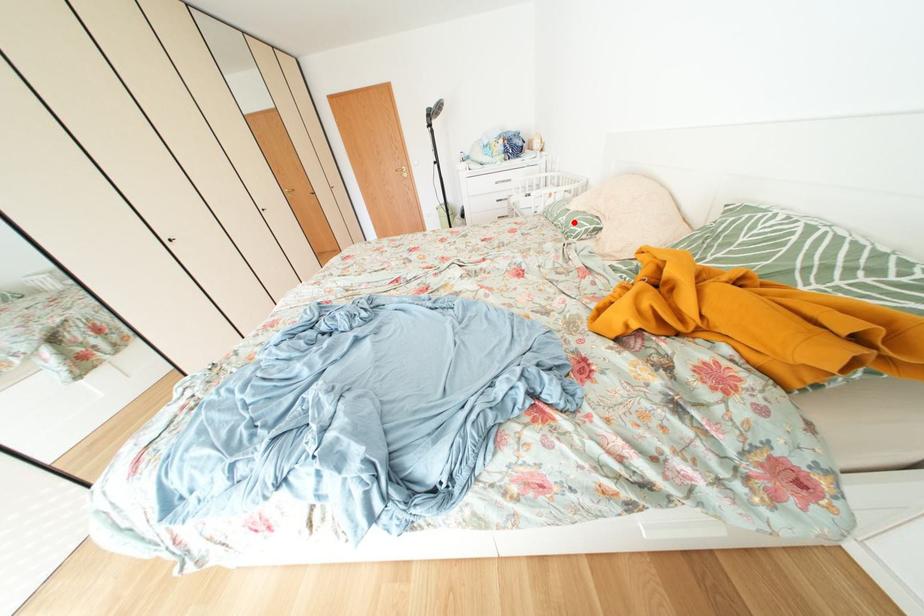
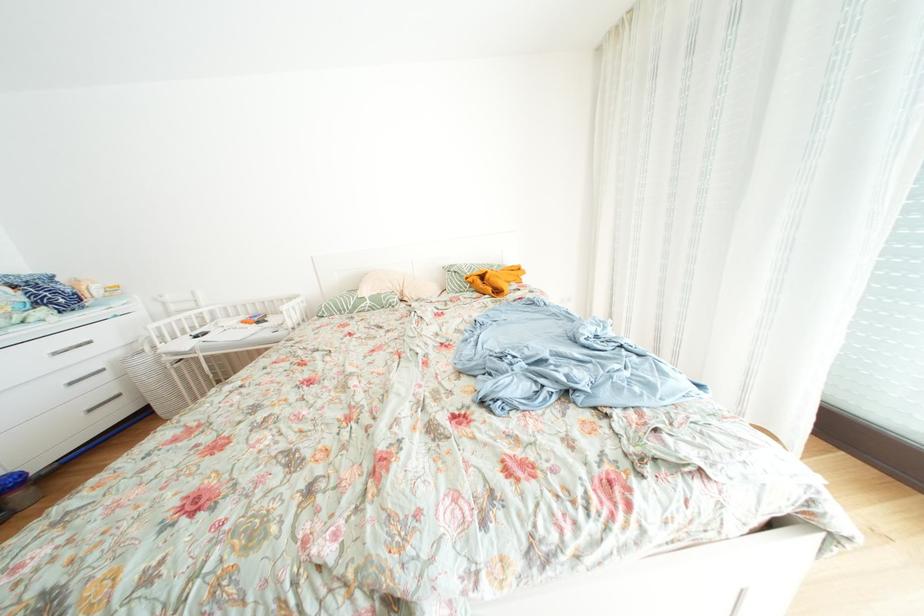
The point at the highlighted location is marked in the first image. Where is the corresponding point in the second image?

(378, 307)